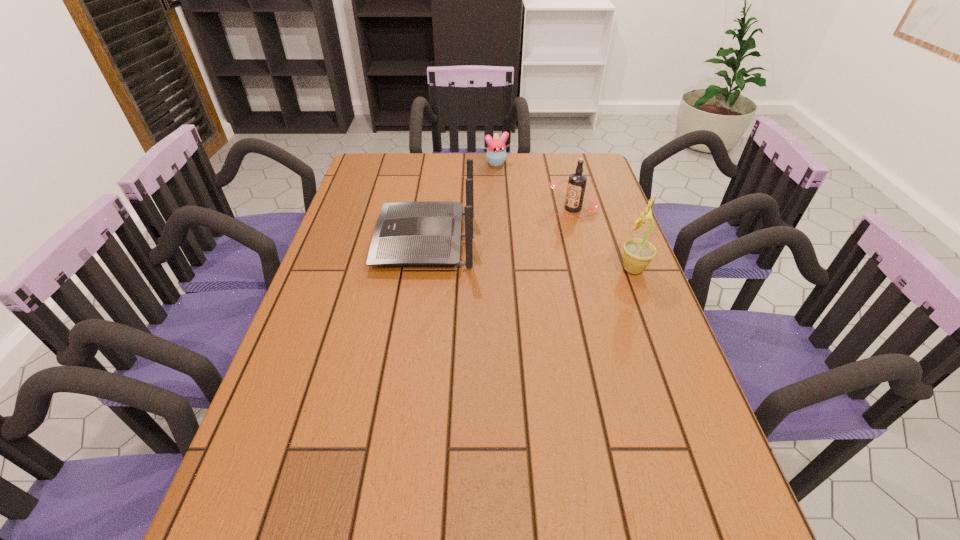
Find the location of `the leftmost object`. the leftmost object is located at coordinates (424, 233).

Where is `sunflower`? sunflower is located at coordinates (638, 253).

Image resolution: width=960 pixels, height=540 pixels. What are the coordinates of `root beer` in the screenshot? It's located at (577, 181).

Locate an element on the screen. This screenshot has height=540, width=960. the shortest object is located at coordinates (496, 151).

Where is `the farthest object`? Image resolution: width=960 pixels, height=540 pixels. the farthest object is located at coordinates (496, 151).

Image resolution: width=960 pixels, height=540 pixels. I want to click on vacant space situated on the front-facing side of the router, so click(x=342, y=241).

Locate an element on the screen. vacant space situated 0.060m on the front-facing side of the router is located at coordinates (357, 241).

Where is `free space located on the front-facing side of the router`? This screenshot has height=540, width=960. free space located on the front-facing side of the router is located at coordinates (357, 241).

Locate an element on the screen. This screenshot has height=540, width=960. blank space located 0.050m on the face of the sunflower is located at coordinates (599, 269).

Identify the location of vacant area situated on the face of the sunflower. The image size is (960, 540). (519, 269).